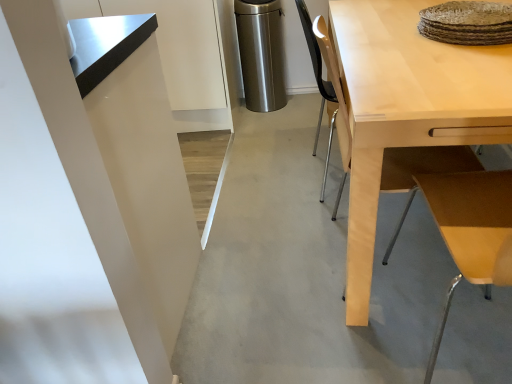
Question: Considering the relative positions of light wood table at upper right and light wood desk at right in the image provided, is light wood table at upper right to the left of light wood desk at right from the viewer's perspective?

Choices:
 (A) no
 (B) yes

Answer: (B)

Question: Would you say light wood table at upper right is outside light wood desk at right?

Choices:
 (A) yes
 (B) no

Answer: (A)

Question: Is light wood table at upper right bigger than light wood desk at right?

Choices:
 (A) no
 (B) yes

Answer: (A)

Question: Considering the relative sizes of light wood table at upper right and light wood desk at right in the image provided, is light wood table at upper right wider than light wood desk at right?

Choices:
 (A) no
 (B) yes

Answer: (A)

Question: Is light wood table at upper right facing away from light wood desk at right?

Choices:
 (A) no
 (B) yes

Answer: (A)

Question: Is light wood table at upper right touching light wood desk at right?

Choices:
 (A) no
 (B) yes

Answer: (A)

Question: Can you confirm if light wood desk at right is thinner than light wood table at upper right?

Choices:
 (A) no
 (B) yes

Answer: (A)

Question: From the image's perspective, is light wood desk at right beneath light wood table at upper right?

Choices:
 (A) no
 (B) yes

Answer: (A)

Question: From a real-world perspective, is light wood desk at right under light wood table at upper right?

Choices:
 (A) yes
 (B) no

Answer: (A)

Question: Is light wood table at upper right inside light wood desk at right?

Choices:
 (A) no
 (B) yes

Answer: (A)

Question: Does light wood desk at right have a greater width compared to light wood table at upper right?

Choices:
 (A) no
 (B) yes

Answer: (B)

Question: Considering the relative positions of light wood desk at right and light wood table at upper right in the image provided, is light wood desk at right to the right of light wood table at upper right from the viewer's perspective?

Choices:
 (A) yes
 (B) no

Answer: (A)

Question: Considering the relative sizes of light wood table at upper right and stainless steel trash can at center in the image provided, is light wood table at upper right thinner than stainless steel trash can at center?

Choices:
 (A) no
 (B) yes

Answer: (A)